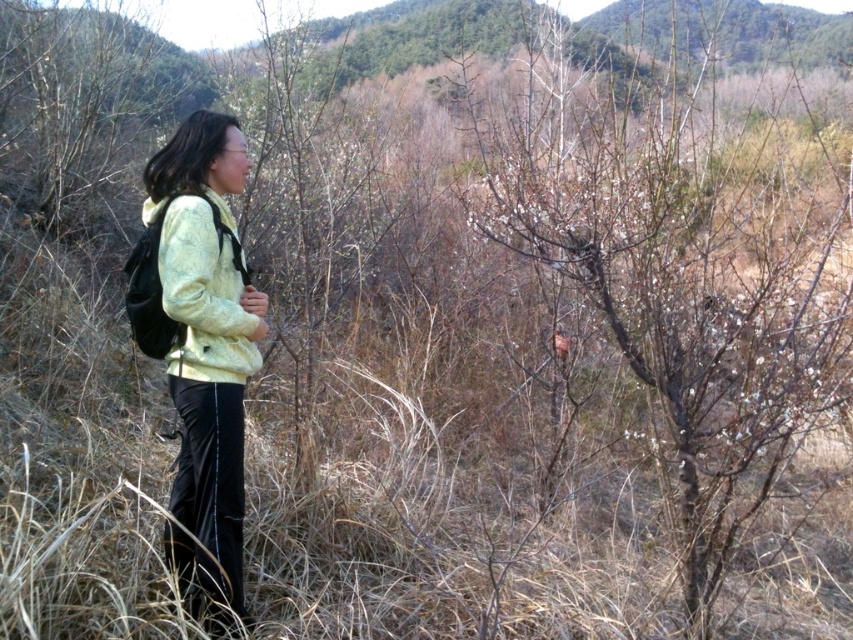
This screenshot has height=640, width=853. I want to click on bare branches at center, so click(x=682, y=280).

Is bare branches at center further to camera compared to yellow textured jacket at left?

That is True.

Identify the location of bare branches at center. (682, 280).

Locate an element on the screen. The width and height of the screenshot is (853, 640). bare branches at center is located at coordinates (682, 280).

Who is shorter, light yellow fleece at center or yellow textured jacket at left?

Standing shorter between the two is yellow textured jacket at left.

Can you confirm if light yellow fleece at center is smaller than yellow textured jacket at left?

Incorrect, light yellow fleece at center is not smaller in size than yellow textured jacket at left.

Does point (160, 227) come behind point (161, 292)?

Yes.

Identify the location of light yellow fleece at center. Image resolution: width=853 pixels, height=640 pixels. (200, 346).

Which of these two, bare branches at center or light yellow fleece at center, stands shorter?

light yellow fleece at center

Does bare branches at center appear under light yellow fleece at center?

No.

Who is more forward, (647, 147) or (209, 529)?

Point (209, 529) is more forward.

This screenshot has width=853, height=640. In order to click on bare branches at center in this screenshot , I will do (x=682, y=280).